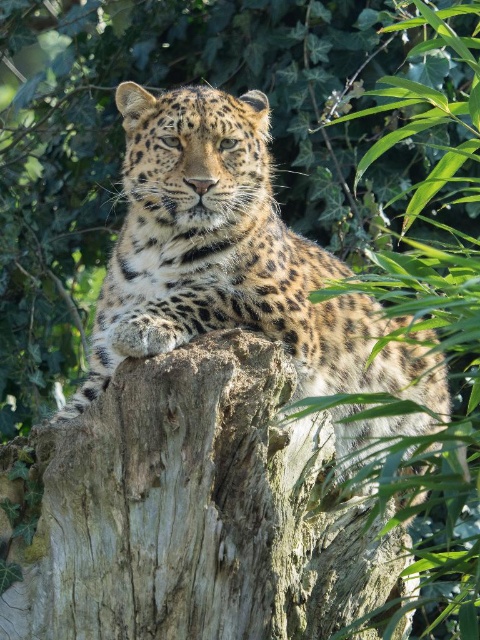
Is brown rough bark at center thinner than spotted fur leopard at center?

Correct, brown rough bark at center's width is less than spotted fur leopard at center's.

Between brown rough bark at center and spotted fur leopard at center, which one is positioned lower?

brown rough bark at center

Who is more distant from viewer, (3, 458) or (123, 122)?

The point (123, 122) is behind.

This screenshot has height=640, width=480. I want to click on brown rough bark at center, so click(x=190, y=512).